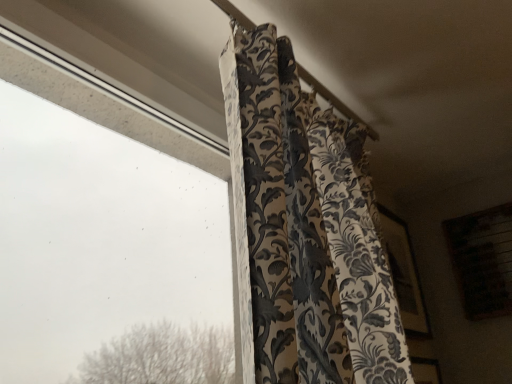
This screenshot has width=512, height=384. Describe the element at coordinates (304, 229) in the screenshot. I see `floral-patterned fabric at center` at that location.

I want to click on floral-patterned fabric at center, so click(304, 229).

Locate an element on the screen. Image resolution: width=512 pixels, height=384 pixels. floral-patterned fabric at center is located at coordinates (304, 229).